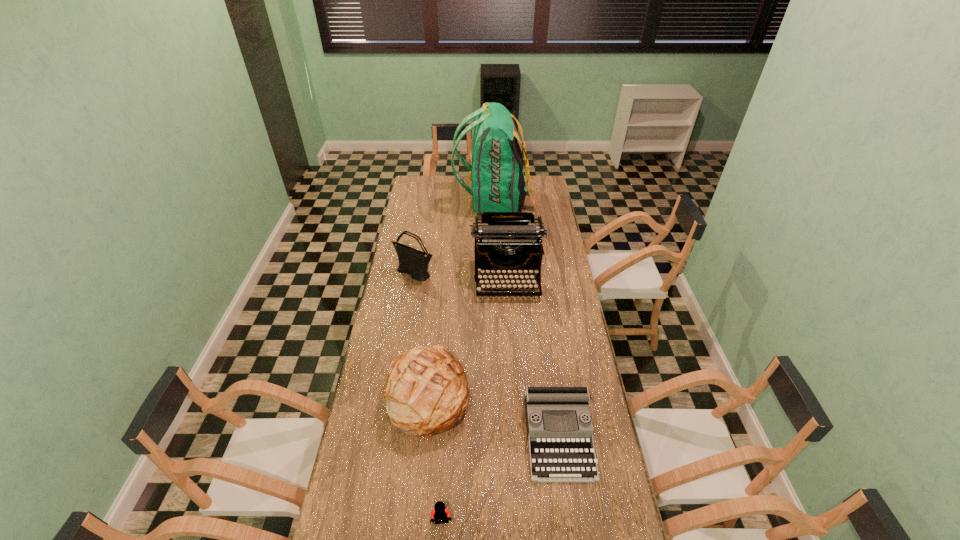
Where is `backpack`? The image size is (960, 540). backpack is located at coordinates (497, 179).

The height and width of the screenshot is (540, 960). What are the coordinates of `the tallest object` in the screenshot? It's located at (497, 179).

The height and width of the screenshot is (540, 960). Identify the location of the taller typewriter. (507, 242).

At what (x,y) coordinates should I click in order to perform the action: click on shoulder bag. Please return your answer as a coordinate pair (x, y). The height and width of the screenshot is (540, 960). Looking at the image, I should click on (415, 263).

This screenshot has width=960, height=540. What are the coordinates of `the third shortest object` in the screenshot? It's located at click(x=426, y=392).

Where is `the shorter typewriter`? This screenshot has height=540, width=960. the shorter typewriter is located at coordinates (559, 427).

Image resolution: width=960 pixels, height=540 pixels. Find the location of `Lego`. Lego is located at coordinates (439, 512).

The width and height of the screenshot is (960, 540). Find the location of `vacant area located on the back of the backpack`. vacant area located on the back of the backpack is located at coordinates (409, 201).

The height and width of the screenshot is (540, 960). I want to click on blank area located on the back of the backpack, so click(x=420, y=201).

Image resolution: width=960 pixels, height=540 pixels. Find the location of `free space located 0.050m on the back of the backpack`. free space located 0.050m on the back of the backpack is located at coordinates (446, 201).